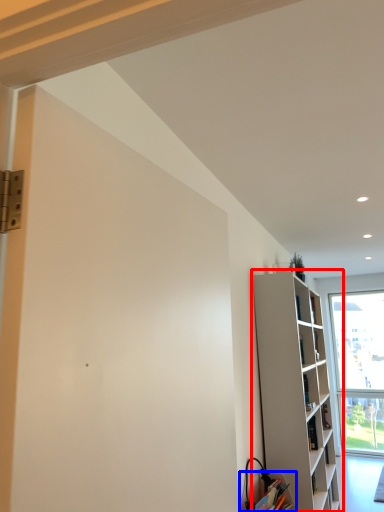
Question: Which object appears farthest to the camera in this image, shelf (highlighted by a red box) or cabinetry (highlighted by a blue box)?

Choices:
 (A) shelf
 (B) cabinetry

Answer: (A)